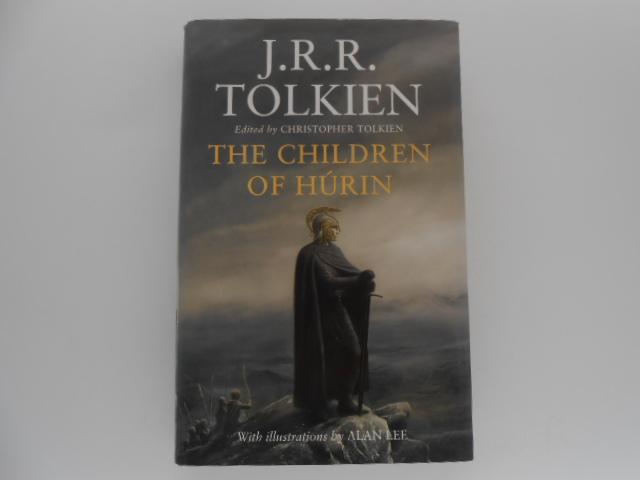
The height and width of the screenshot is (480, 640). Identify the location of book. (436, 245).